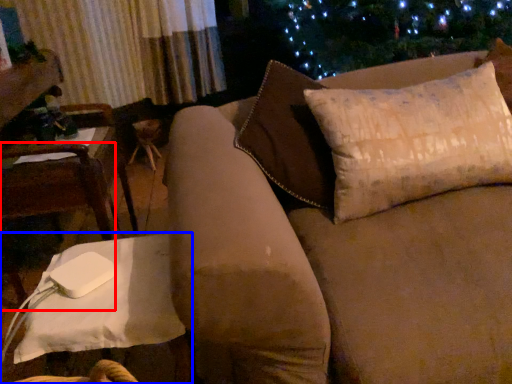
Question: Among these objects, which one is farthest to the camera, chair (highlighted by a red box) or table (highlighted by a blue box)?

Choices:
 (A) chair
 (B) table

Answer: (A)